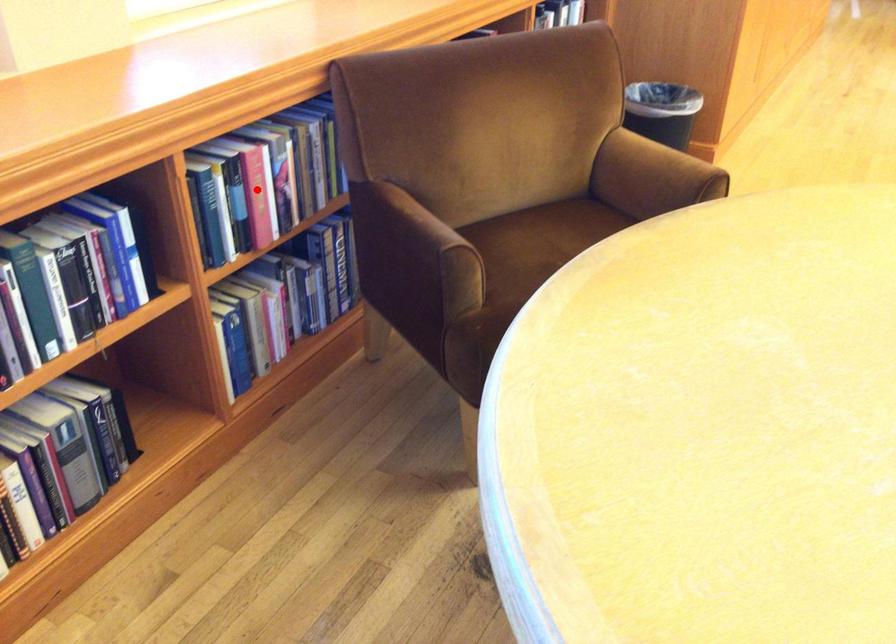
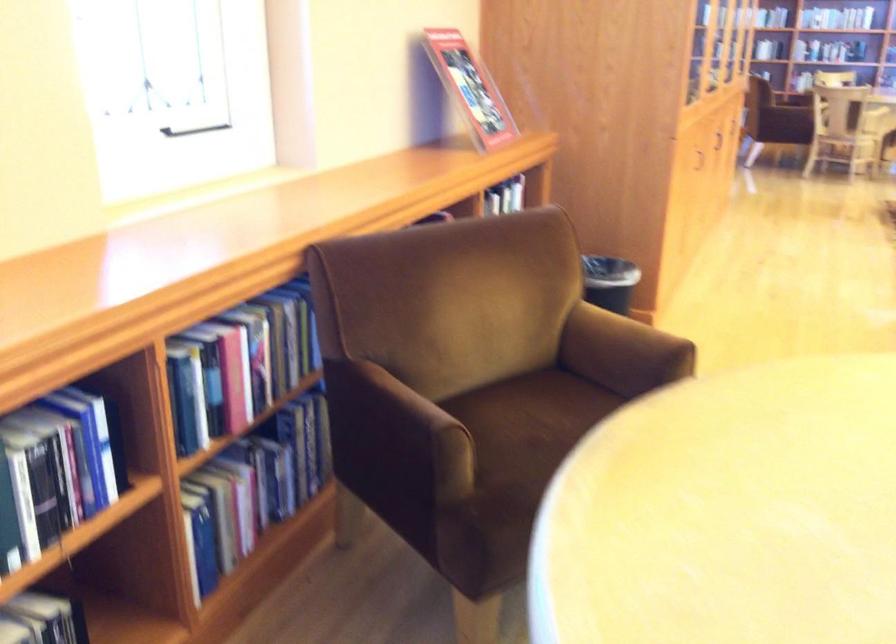
Where in the second image is the point corresponding to the highlighted location from the first image?

(234, 375)